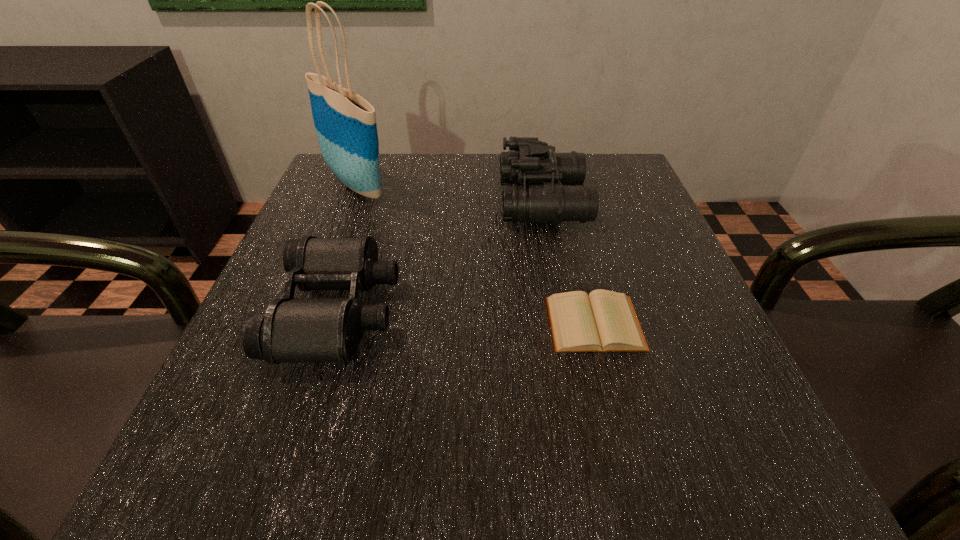
The height and width of the screenshot is (540, 960). Identify the location of free point between the tallest object and the taller binoculars. (450, 193).

Identify the location of empty space that is in between the shortest object and the tote bag. This screenshot has width=960, height=540. (476, 254).

Locate an element on the screen. The image size is (960, 540). vacant point located between the shortest object and the second tallest object is located at coordinates (569, 262).

At what (x,y) coordinates should I click in order to perform the action: click on vacant area that lies between the farther binoculars and the left binoculars. Please return your answer as a coordinate pair (x, y). Looking at the image, I should click on (441, 255).

Locate an element on the screen. free space between the right binoculars and the tote bag is located at coordinates (450, 193).

This screenshot has width=960, height=540. I want to click on free space between the tallest object and the right binoculars, so click(450, 193).

Select which object appears as the second closest to the taller binoculars. Please provide its 2D coordinates. Your answer should be formatted as a tuple, i.e. [(x, y)], where the tuple contains the x and y coordinates of a point satisfying the conditions above.

[(293, 329)]

Identify which object is the closest to the tallest object. Please provide its 2D coordinates. Your answer should be formatted as a tuple, i.e. [(x, y)], where the tuple contains the x and y coordinates of a point satisfying the conditions above.

[(293, 329)]

Find the location of a particular element. This screenshot has height=540, width=960. free space that satisfies the following two spatial constraints: 1. through the lenses of the right binoculars; 2. on the left side of the shortest object is located at coordinates point(566,323).

The image size is (960, 540). Find the location of `vacant space that satisfies the following two spatial constraints: 1. on the front side of the tote bag; 2. on the left side of the diary`. vacant space that satisfies the following two spatial constraints: 1. on the front side of the tote bag; 2. on the left side of the diary is located at coordinates (303, 323).